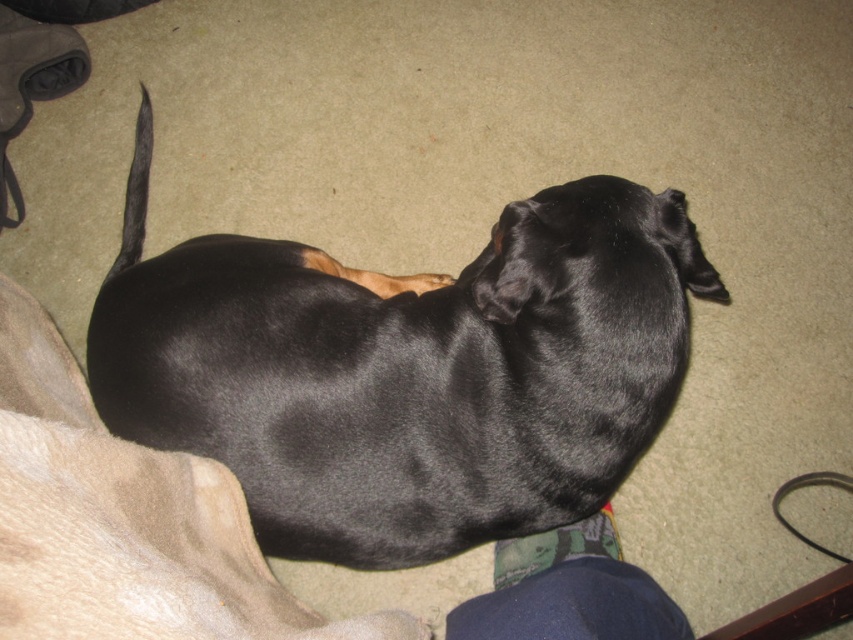
Who is more distant from viewer, (592, 444) or (805, 538)?

The point (805, 538) is behind.

Is point (149, 352) positioned after point (842, 557)?

No, it is in front of (842, 557).

You are a GUI agent. You are given a task and a screenshot of the screen. Output one action in this format:
    pyautogui.click(x=<x>, y=<y>)
    Task: Click on the shiny black dog at center
    
    Given the screenshot: What is the action you would take?
    pyautogui.click(x=405, y=369)